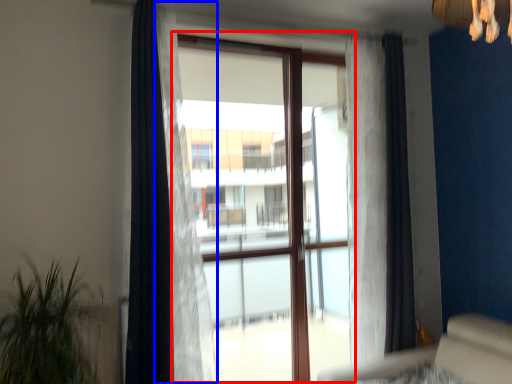
Question: Among these objects, which one is nearest to the camera, bay window (highlighted by a red box) or curtain (highlighted by a blue box)?

Choices:
 (A) bay window
 (B) curtain

Answer: (B)